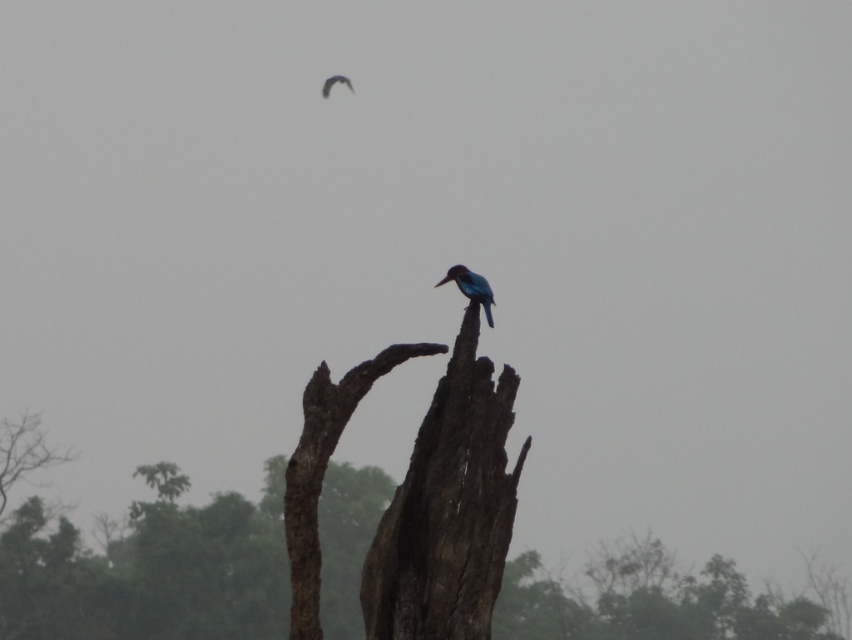
You are standing in front of the tree stump and want to place a small decoration on the point closer to you. Which point should you choose between point (x=498, y=417) and point (x=452, y=268)?

Point (x=498, y=417) is closer to the camera than point (x=452, y=268), so you should choose point (x=498, y=417) to place the decoration.

You are an ornithologist observing the scene. You need to determine the relative height of the smooth brown wood at center and the shiny blue bird at upper center. Which object is taller?

The shiny blue bird at upper center is taller than the smooth brown wood at center.